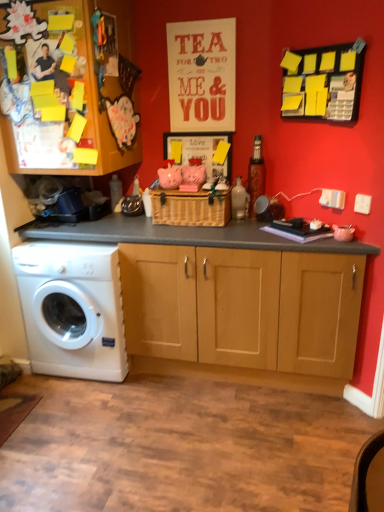
I want to click on free spot to the right of white plastic washing machine at lower left, so click(160, 391).